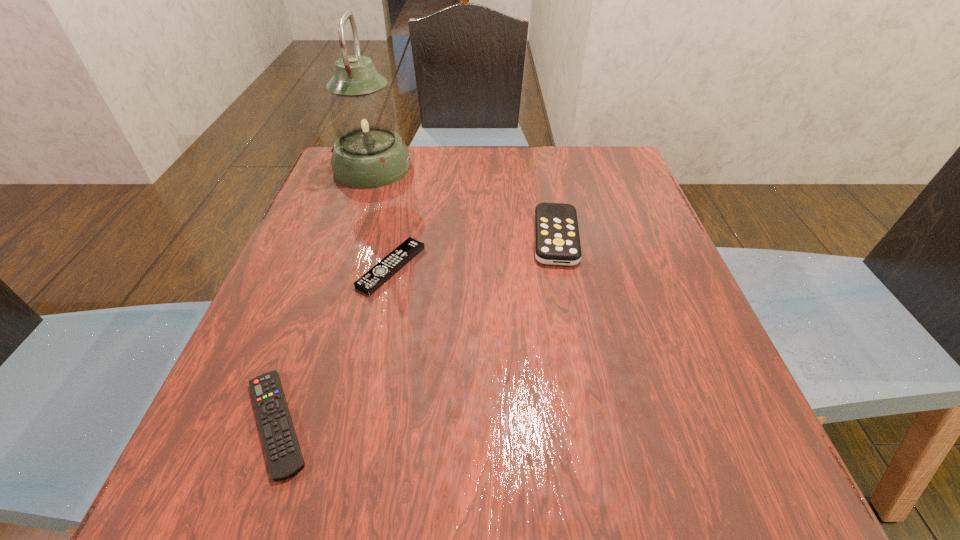
Identify the location of the tallest object. Image resolution: width=960 pixels, height=540 pixels. (368, 153).

Locate an element on the screen. The width and height of the screenshot is (960, 540). the farthest object is located at coordinates (368, 153).

Locate an element on the screen. The height and width of the screenshot is (540, 960). the rightmost remote control is located at coordinates (557, 242).

Locate an element on the screen. the third shortest object is located at coordinates (557, 242).

The width and height of the screenshot is (960, 540). Identify the location of the nearest remote control. (284, 457).

The image size is (960, 540). I want to click on vacant space located 0.230m on the right of the farthest object, so click(500, 167).

Find the location of a particular element. vacant region located 0.260m on the left of the rightmost object is located at coordinates (408, 237).

This screenshot has height=540, width=960. What are the coordinates of `vacant area located on the back of the nearest object` in the screenshot? It's located at (333, 262).

You are a GUI agent. You are given a task and a screenshot of the screen. Output one action in this format:
    pyautogui.click(x=<x>, y=<y>)
    Task: Click on the object that is at the far edge
    This screenshot has height=540, width=960.
    Given the screenshot: What is the action you would take?
    pyautogui.click(x=368, y=153)

This screenshot has height=540, width=960. Identify the location of object that is at the near edge. (284, 457).